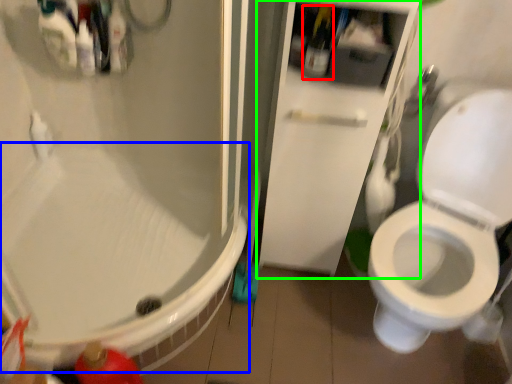
Question: Which object is the closest to the bottle (highlighted by a red box)? Choose among these: bath (highlighted by a blue box) or screen door (highlighted by a green box).

Choices:
 (A) bath
 (B) screen door

Answer: (B)